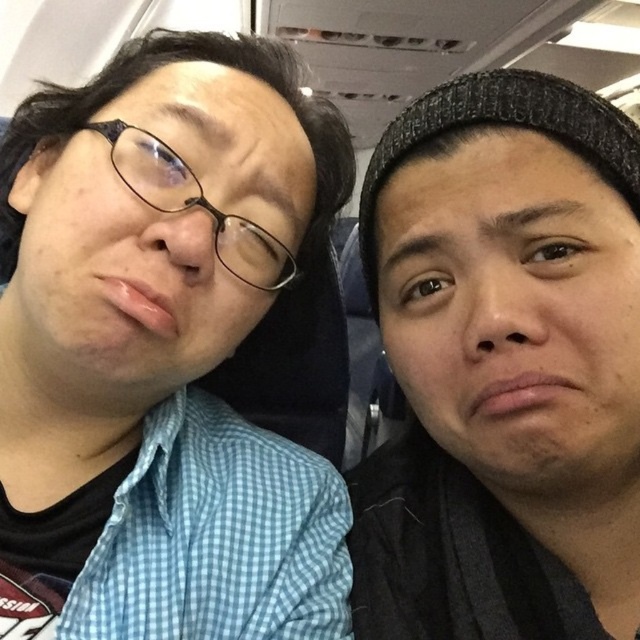
Question: Among these points, which one is farthest from the camera?

Choices:
 (A) (120, 531)
 (B) (513, 314)

Answer: (A)

Question: Can you confirm if blue checkered shirt at left is bigger than black knit cap at upper right?

Choices:
 (A) yes
 (B) no

Answer: (A)

Question: Which point is farther to the camera?

Choices:
 (A) (412, 220)
 (B) (340, 600)

Answer: (B)

Question: Is blue checkered shirt at left above black knit cap at upper right?

Choices:
 (A) no
 (B) yes

Answer: (B)

Question: Can you confirm if blue checkered shirt at left is positioned above black knit cap at upper right?

Choices:
 (A) no
 (B) yes

Answer: (B)